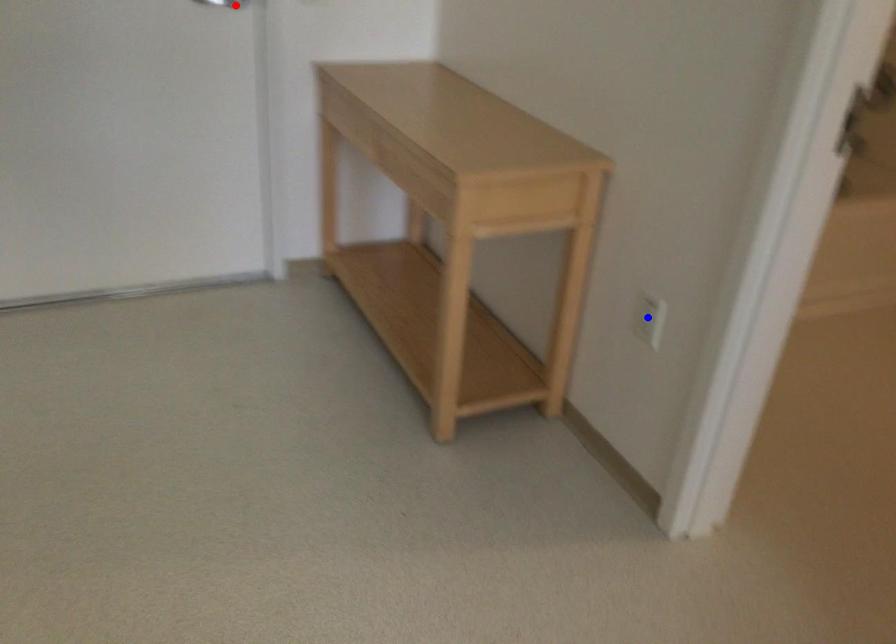
Question: Two points are marked on the image. Which point is closer to the camera?

Choices:
 (A) Blue point is closer.
 (B) Red point is closer.

Answer: (A)